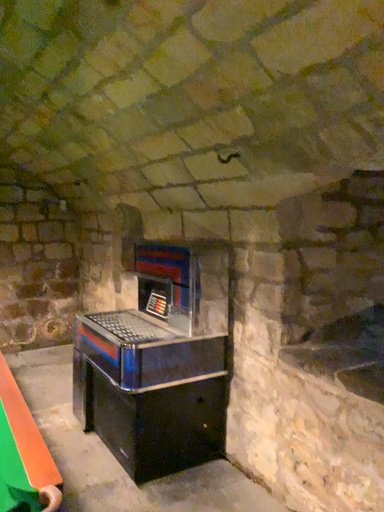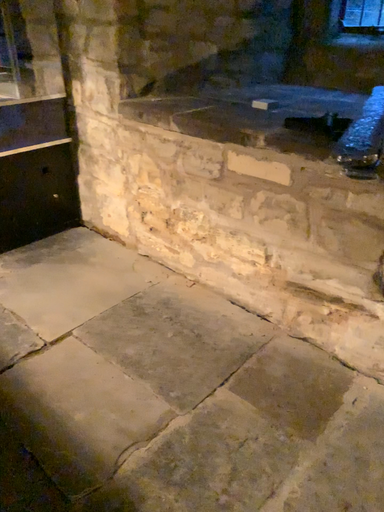
Question: Which way did the camera rotate in the video?

Choices:
 (A) rotated left
 (B) rotated right

Answer: (B)